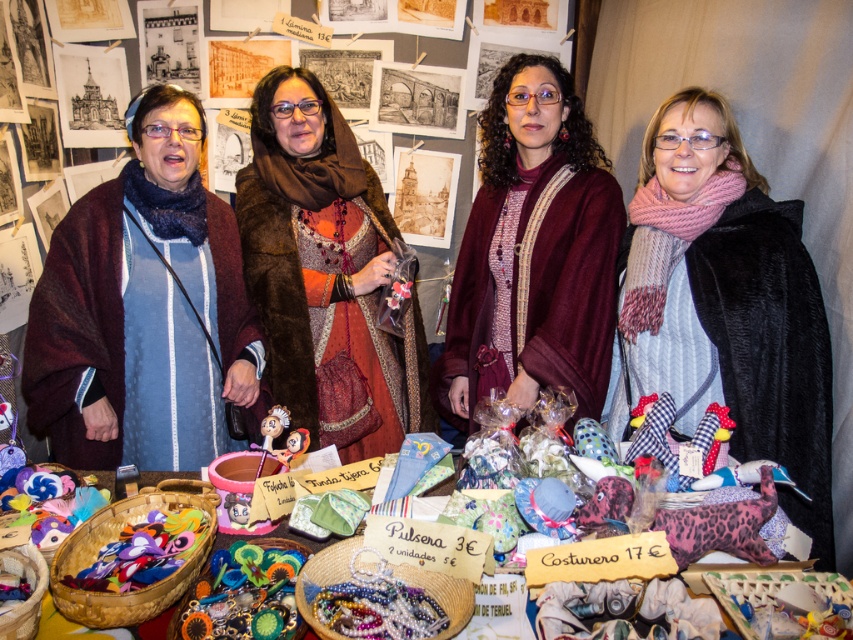
You are a customer at the craft fair and want to pick up the maroon woolen shawl at left and the brightly colored felt crafts at center. If you need to reach both items without moving your position, what is the minimum distance you need to stretch your arm?

The maroon woolen shawl at left is 21.30 inches from the brightly colored felt crafts at center, so you need to stretch your arm at least 21.30 inches to reach both items without moving your position.

You are a customer at the craft fair and want to buy both the maroon woolen shawl at left and the pink knitted scarf at right. If your arms can carry items up to 4 feet apart, can you comfortably hold both items at the same time?

The maroon woolen shawl at left and pink knitted scarf at right are 4.15 feet apart. Since your arms can only reach up to 4 feet, you cannot comfortably hold both items at the same time.

You are a customer at the craft fair looking to buy a gift. You see the maroon woolen shawl at left and the pink knitted scarf at right. Which item is located more to the left side of the table?

The maroon woolen shawl at left is positioned on the left side of the pink knitted scarf at right, so it is more to the left.